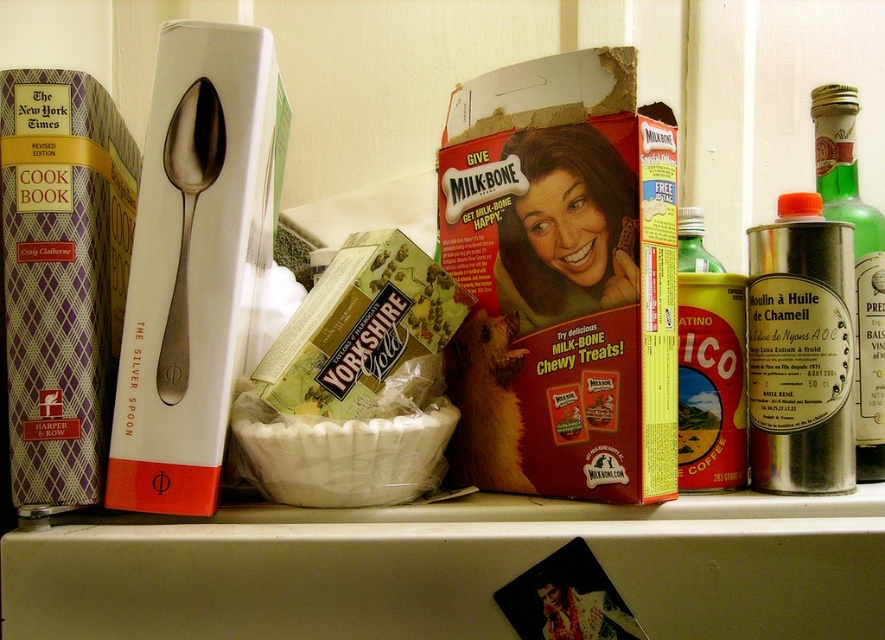
You are organizing the shelf and want to place a new item between the two metallic silver canisters. Is there space available between the metallic silver canister at right and the metallic silver canister at center right?

The metallic silver canister at right is to the right of the metallic silver canister at center right, meaning there is no space between them. Therefore, you cannot place an item between them.

You have a 12 inch ruler and want to measure the distance between the silver metallic canister at right and the camera. Will the ruler be sufficient? Please explain.

The distance between the silver metallic canister at right and the camera is 21.74 inches. Since the ruler is only 12 inches long, it will not be sufficient to measure the entire distance. You would need a longer measuring tool.